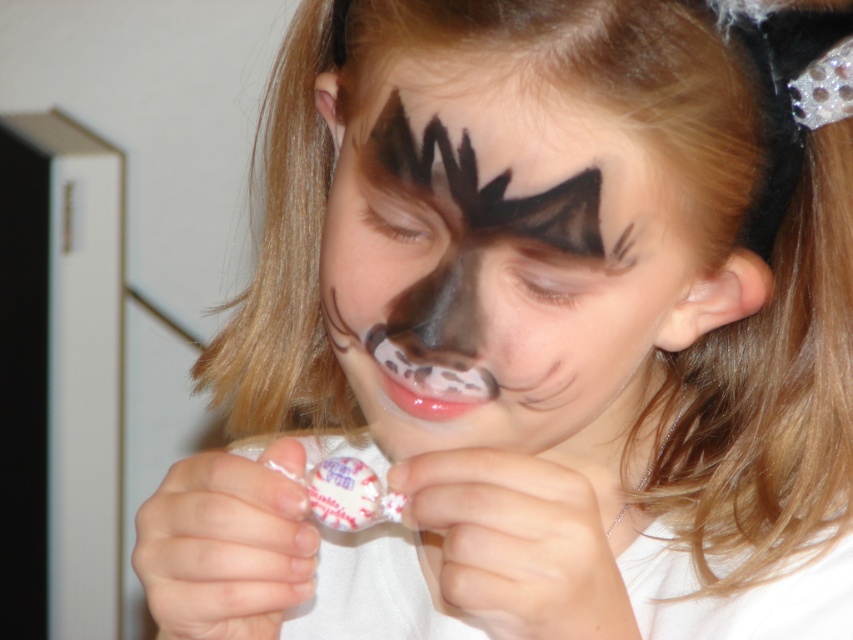
Question: Considering the real-world distances, which object is closest to the matte black nose at center?

Choices:
 (A) matte black face paint at center
 (B) black matte eyebrow at upper center

Answer: (A)

Question: Which object appears farthest from the camera in this image?

Choices:
 (A) matte black nose at center
 (B) black matte/soft eyebrow at upper center
 (C) matte black face paint at center

Answer: (A)

Question: Observing the image, what is the correct spatial positioning of matte black face paint at center in reference to black matte/soft eyebrow at upper center?

Choices:
 (A) below
 (B) above

Answer: (A)

Question: Which point is farther from the camera taking this photo?

Choices:
 (A) (465, 362)
 (B) (445, 442)

Answer: (B)

Question: Can you confirm if black matte/soft eyebrow at upper center is thinner than matte black nose at center?

Choices:
 (A) no
 (B) yes

Answer: (A)

Question: From the image, what is the correct spatial relationship of black matte/soft eyebrow at upper center in relation to matte black nose at center?

Choices:
 (A) below
 (B) above

Answer: (B)